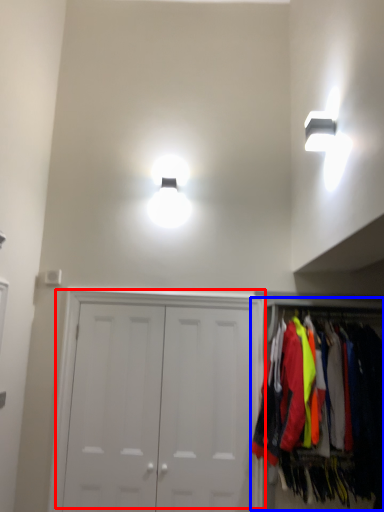
Question: Which of the following is the farthest to the observer, door (highlighted by a red box) or closet (highlighted by a blue box)?

Choices:
 (A) door
 (B) closet

Answer: (A)